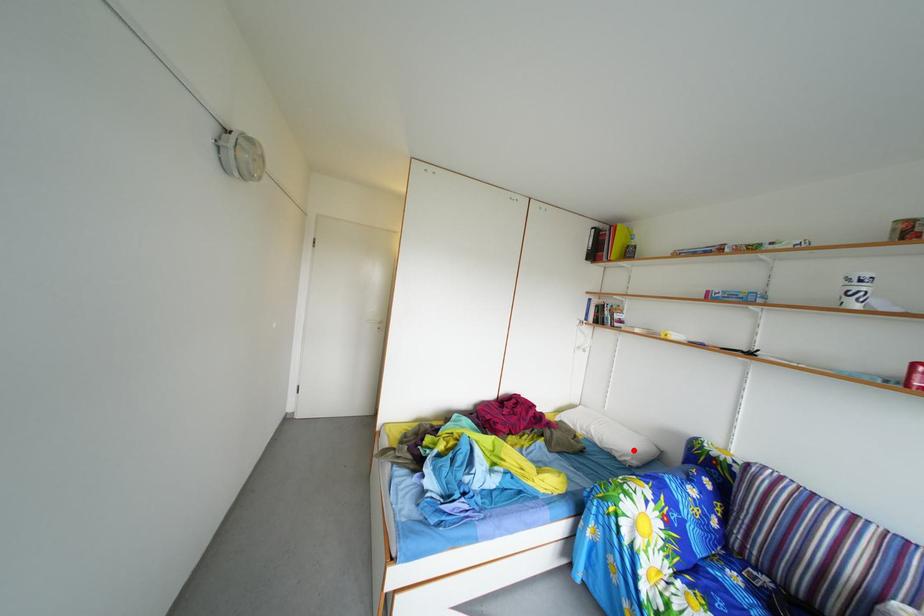
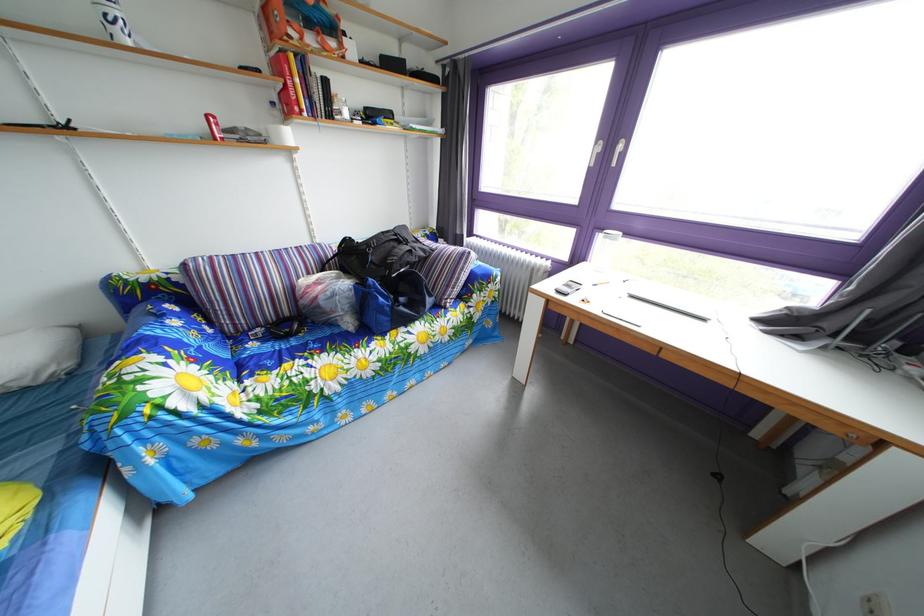
The point at the highlighted location is marked in the first image. Where is the corresponding point in the second image?

(18, 370)